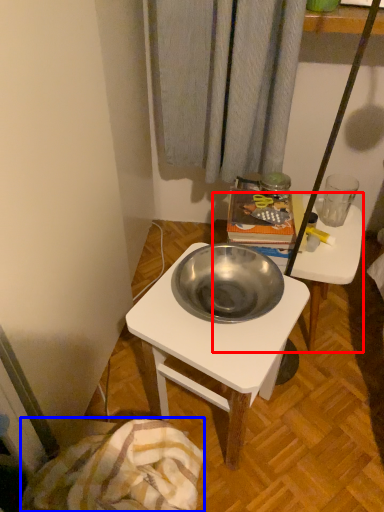
Question: Which object appears closest to the camera in this image, table (highlighted by a red box) or blanket (highlighted by a blue box)?

Choices:
 (A) table
 (B) blanket

Answer: (B)